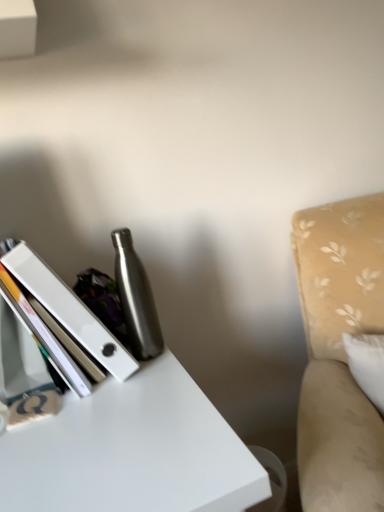
The height and width of the screenshot is (512, 384). What are the coordinates of `white glossy book at left` in the screenshot? It's located at (66, 310).

Identify the location of white glossy book at left. (66, 310).

Considering the positions of objects brushed metal water bottle at center and white glossy book at left in the image provided, who is more to the right, brushed metal water bottle at center or white glossy book at left?

From the viewer's perspective, brushed metal water bottle at center appears more on the right side.

Which object is closer to the camera taking this photo, brushed metal water bottle at center or white glossy book at left?

Positioned in front is white glossy book at left.

Could you tell me if brushed metal water bottle at center is turned towards white glossy book at left?

No, brushed metal water bottle at center is not aimed at white glossy book at left.

Is brushed metal water bottle at center not inside beige fabric swivel chair at right?

brushed metal water bottle at center lies outside beige fabric swivel chair at right's area.

Is brushed metal water bottle at center touching beige fabric swivel chair at right?

No, brushed metal water bottle at center is not with beige fabric swivel chair at right.

Considering the relative sizes of brushed metal water bottle at center and beige fabric swivel chair at right in the image provided, is brushed metal water bottle at center smaller than beige fabric swivel chair at right?

Yes, brushed metal water bottle at center is smaller than beige fabric swivel chair at right.

Is brushed metal water bottle at center facing towards beige fabric swivel chair at right?

No, brushed metal water bottle at center is not aimed at beige fabric swivel chair at right.

From the image's perspective, is beige fabric swivel chair at right beneath brushed metal water bottle at center?

Indeed, from the image's perspective, beige fabric swivel chair at right is shown beneath brushed metal water bottle at center.

Is beige fabric swivel chair at right facing towards brushed metal water bottle at center?

No.

Would you say beige fabric swivel chair at right is inside or outside brushed metal water bottle at center?

beige fabric swivel chair at right is located beyond the bounds of brushed metal water bottle at center.

Is beige fabric swivel chair at right positioned far away from white glossy book at left?

No, there isn't a large distance between beige fabric swivel chair at right and white glossy book at left.

Considering the positions of points (319, 225) and (44, 287), is point (319, 225) closer to camera compared to point (44, 287)?

No, it is not.

How different are the orientations of beige fabric swivel chair at right and white glossy book at left in degrees?

37.6 degrees separate the facing orientations of beige fabric swivel chair at right and white glossy book at left.

Considering the sizes of objects beige fabric swivel chair at right and white glossy book at left in the image provided, who is bigger, beige fabric swivel chair at right or white glossy book at left?

With larger size is beige fabric swivel chair at right.

Between white glossy book at left and brushed metal water bottle at center, which one is positioned behind?

brushed metal water bottle at center is further from the camera.

Considering the sizes of objects white glossy book at left and brushed metal water bottle at center in the image provided, who is bigger, white glossy book at left or brushed metal water bottle at center?

white glossy book at left is bigger.

Which point is more distant from viewer, (x=96, y=321) or (x=320, y=325)?

The point (x=320, y=325) is behind.

In the scene shown: Relative to beige fabric swivel chair at right, is white glossy book at left in front or behind?

In the image, white glossy book at left appears behind beige fabric swivel chair at right.

From a real-world perspective, is white glossy book at left located higher than beige fabric swivel chair at right?

Yes, from a real-world perspective, white glossy book at left is on top of beige fabric swivel chair at right.

Identify the location of book on the left of brushed metal water bottle at center. (66, 310).

The height and width of the screenshot is (512, 384). Find the location of `bottle behind the beige fabric swivel chair at right`. bottle behind the beige fabric swivel chair at right is located at coordinates (136, 298).

Considering their positions, is brushed metal water bottle at center positioned closer to white glossy book at left than beige fabric swivel chair at right?

brushed metal water bottle at center is closer to white glossy book at left.

Based on their spatial positions, is beige fabric swivel chair at right or brushed metal water bottle at center further from white glossy book at left?

beige fabric swivel chair at right is positioned further to the anchor white glossy book at left.

Based on their spatial positions, is white glossy book at left or brushed metal water bottle at center closer to beige fabric swivel chair at right?

brushed metal water bottle at center.

Estimate the real-world distances between objects in this image. Which object is closer to brushed metal water bottle at center, beige fabric swivel chair at right or white glossy book at left?

The object closer to brushed metal water bottle at center is white glossy book at left.

Based on their spatial positions, is brushed metal water bottle at center or white glossy book at left further from beige fabric swivel chair at right?

The object further to beige fabric swivel chair at right is white glossy book at left.

From the image, which object appears to be farther from brushed metal water bottle at center, white glossy book at left or beige fabric swivel chair at right?

Among the two, beige fabric swivel chair at right is located further to brushed metal water bottle at center.

This screenshot has height=512, width=384. What are the coordinates of `bottle located between white glossy book at left and beige fabric swivel chair at right in the left-right direction` in the screenshot? It's located at (136, 298).